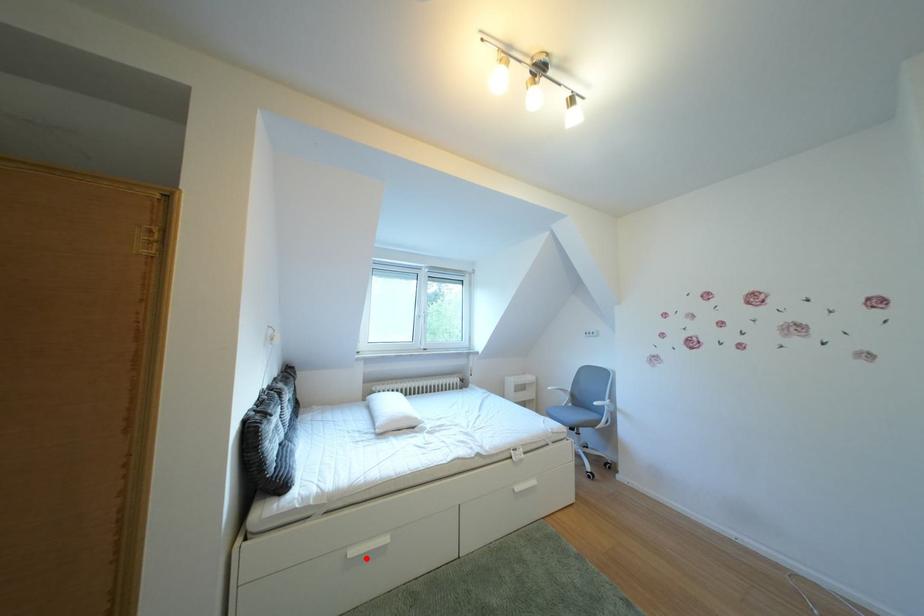
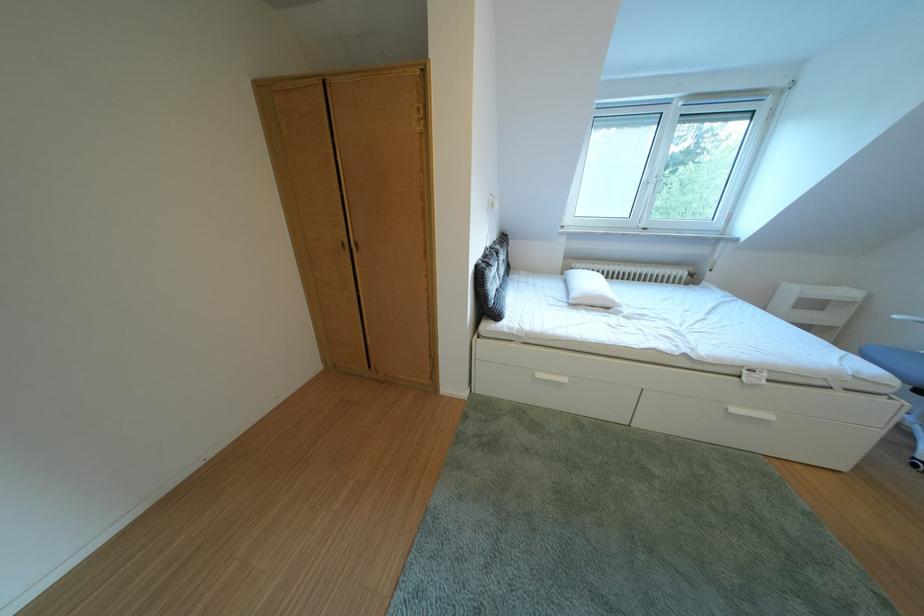
Question: I am providing you with two images of the same scene from different viewpoints. Image1 has a red point marked. In image2, the corresponding 3D location appears at what relative position? Reply with the corresponding letter.

Choices:
 (A) Closer
 (B) Farther

Answer: (B)